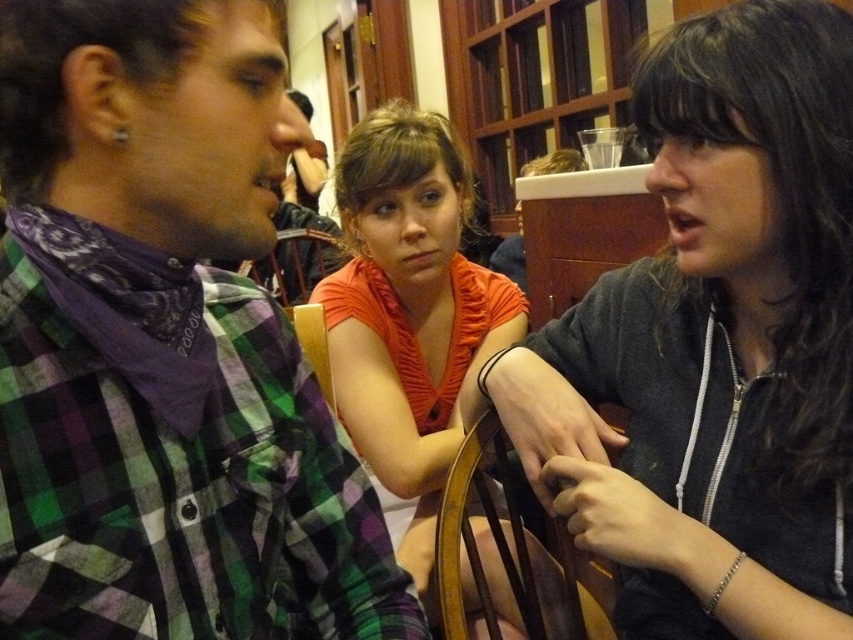
Looking at this image, what are the coordinates of the dark gray hoodie at center right in the image?

The dark gray hoodie at center right is located at coordinates (715, 344).